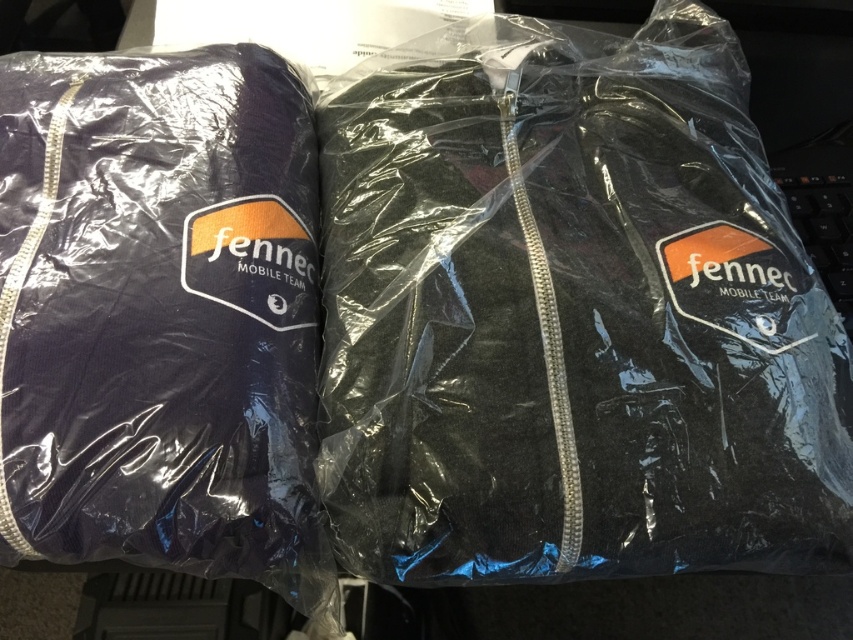
Question: Which of the following is the farthest from the observer?

Choices:
 (A) matte black jacket at center
 (B) matte black jacket at left

Answer: (A)

Question: Is matte black jacket at center further to the viewer compared to matte black jacket at left?

Choices:
 (A) yes
 (B) no

Answer: (A)

Question: Can you confirm if matte black jacket at center is wider than matte black jacket at left?

Choices:
 (A) yes
 (B) no

Answer: (A)

Question: Which object is farther from the camera taking this photo?

Choices:
 (A) matte black jacket at left
 (B) matte black jacket at center

Answer: (B)

Question: Can you confirm if matte black jacket at center is thinner than matte black jacket at left?

Choices:
 (A) no
 (B) yes

Answer: (A)

Question: Which point is closer to the camera taking this photo?

Choices:
 (A) tap(505, 362)
 (B) tap(297, 422)

Answer: (A)